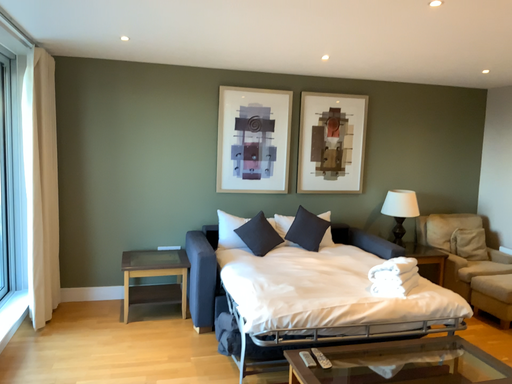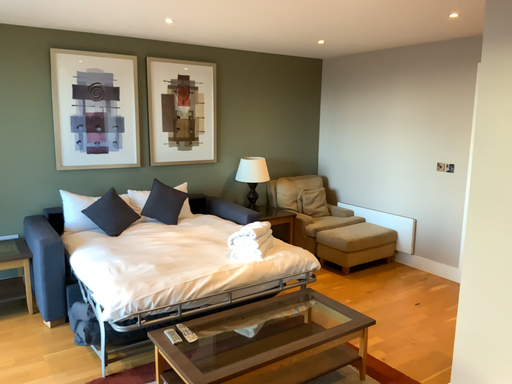
Question: Which way did the camera rotate in the video?

Choices:
 (A) rotated right
 (B) rotated left

Answer: (A)